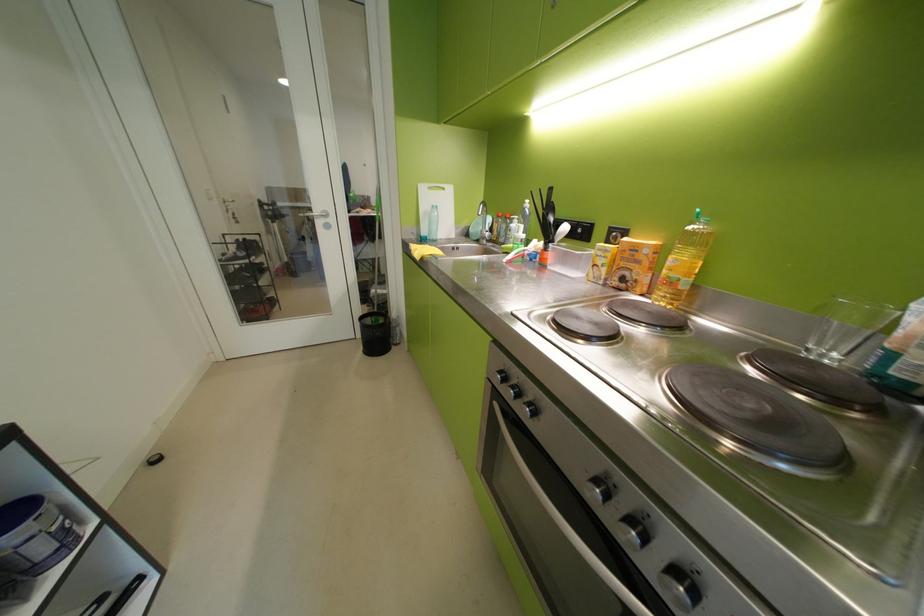
What do you see at coordinates (432, 224) in the screenshot?
I see `the soap dispenser pump` at bounding box center [432, 224].